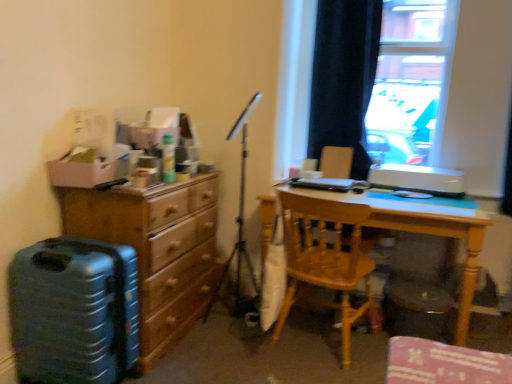
Locate an element on the screen. The height and width of the screenshot is (384, 512). free space below metallic tripod at center (from a real-world perspective) is located at coordinates (226, 326).